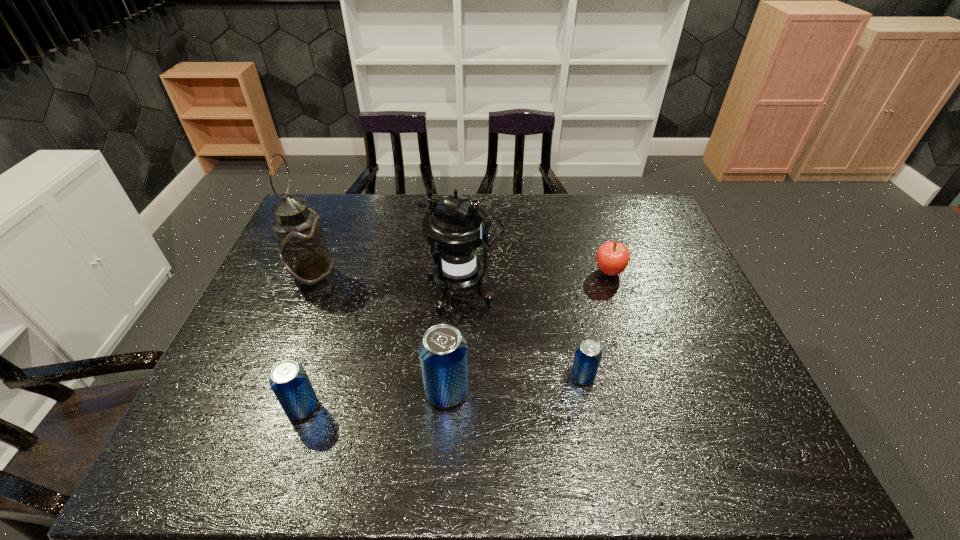
In the image, there is a desktop. At what (x,y) coordinates should I click in order to perform the action: click on vacant area at the near left corner. Please return your answer as a coordinate pair (x, y). Looking at the image, I should click on (222, 409).

Locate an element on the screen. Image resolution: width=960 pixels, height=540 pixels. free space between the tallest beer can and the oil lamp is located at coordinates (380, 335).

Where is `free space that is in between the fifth object from left to right and the third tallest object`? The image size is (960, 540). free space that is in between the fifth object from left to right and the third tallest object is located at coordinates (515, 384).

Find the location of `free spot between the second tallest object and the rightmost beer can`. free spot between the second tallest object and the rightmost beer can is located at coordinates (522, 335).

Identify the location of vacant space in between the apple and the second object from right to left. (596, 325).

This screenshot has height=540, width=960. What are the coordinates of `empty space between the leftmost beer can and the second beer can from right to left` in the screenshot? It's located at coord(374,400).

Locate an element on the screen. This screenshot has width=960, height=540. free spot between the oil lamp and the lantern is located at coordinates (388, 286).

Locate an element on the screen. empty space between the shortest beer can and the tallest beer can is located at coordinates (515, 384).

The height and width of the screenshot is (540, 960). In order to click on vacant space that is in between the shortest beer can and the apple in this screenshot , I will do `click(596, 325)`.

At what (x,y) coordinates should I click in order to perform the action: click on object that is the fifth closest to the lantern. Please return your answer as a coordinate pair (x, y). Image resolution: width=960 pixels, height=540 pixels. Looking at the image, I should click on (289, 381).